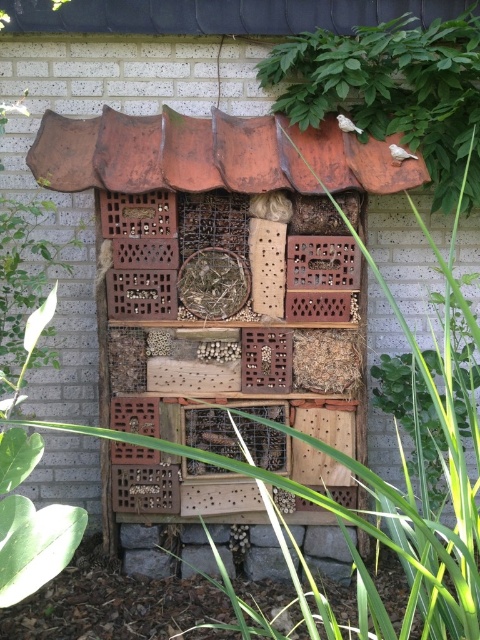
Between green leafy plant at upper right and wooden birdhouse at center, which one is positioned lower?

wooden birdhouse at center is below.

Does green leafy plant at upper right have a lesser height compared to wooden birdhouse at center?

Yes, green leafy plant at upper right is shorter than wooden birdhouse at center.

Is point (458, 145) closer to viewer compared to point (472, 524)?

No, it is not.

You are a GUI agent. You are given a task and a screenshot of the screen. Output one action in this format:
    pyautogui.click(x=<x>, y=<y>)
    Task: Click on the green leafy plant at upper right
    
    Given the screenshot: What is the action you would take?
    pyautogui.click(x=393, y=90)